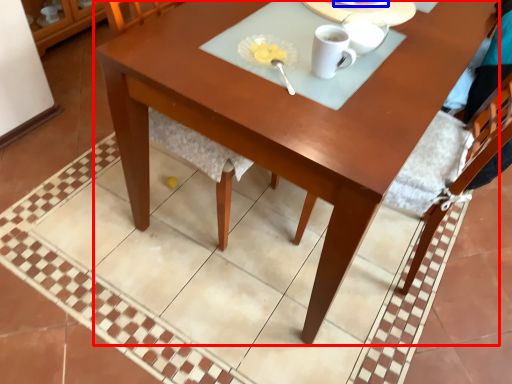
Question: Among these objects, which one is nearest to the camera, desk (highlighted by a red box) or tableware (highlighted by a blue box)?

Choices:
 (A) desk
 (B) tableware

Answer: (A)